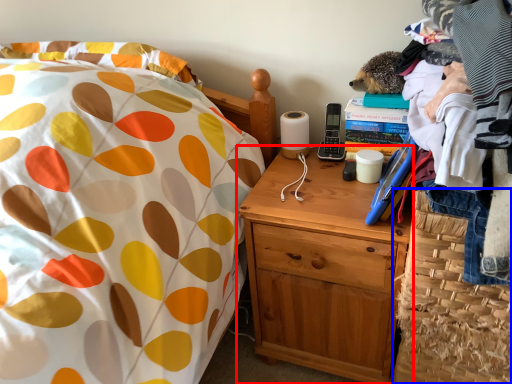
Question: Which object appears farthest to the camera in this image, nightstand (highlighted by a red box) or basket (highlighted by a blue box)?

Choices:
 (A) nightstand
 (B) basket

Answer: (A)